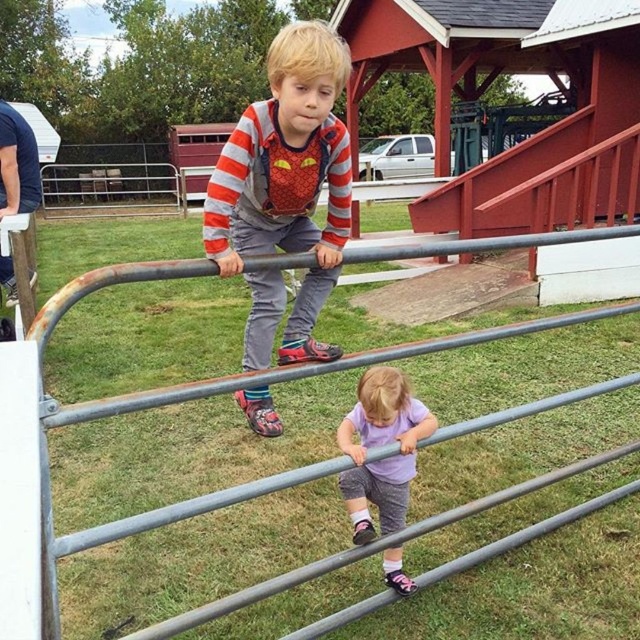
You are a parent supervising two children playing near a metal railing. One child is wearing matte gray overalls at center. How far apart are the two children from each other?

The two children are 5.85 feet apart.

You are a parent trying to determine which child is older based on their clothing. You see the matte gray overalls at center and the purple fabric shirt at lower center. Which child is younger?

The matte gray overalls at center is not as tall as purple fabric shirt at lower center, so the child wearing the matte gray overalls at center is younger because they are shorter in height.